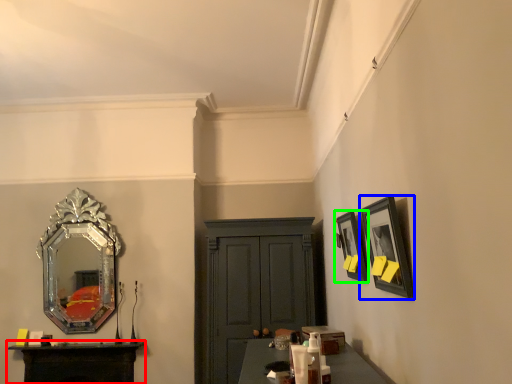
Question: Based on their relative distances, which object is nearer to table (highlighted by a red box)? Choose from picture frame (highlighted by a blue box) and picture frame (highlighted by a green box).

Choices:
 (A) picture frame
 (B) picture frame

Answer: (B)